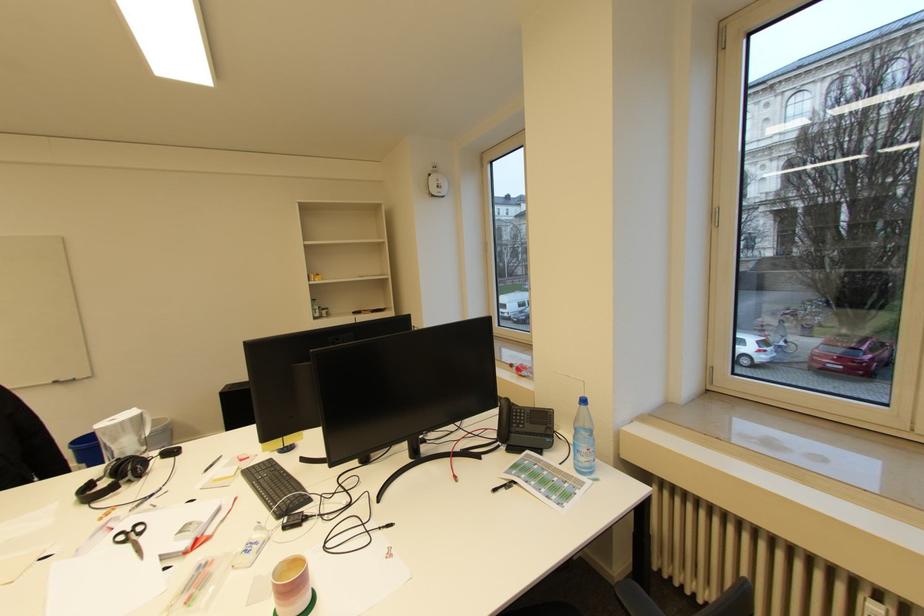
Find where to lift the red tipped pen. Please return your answer as a coordinate pair (x, y).

(204, 529)